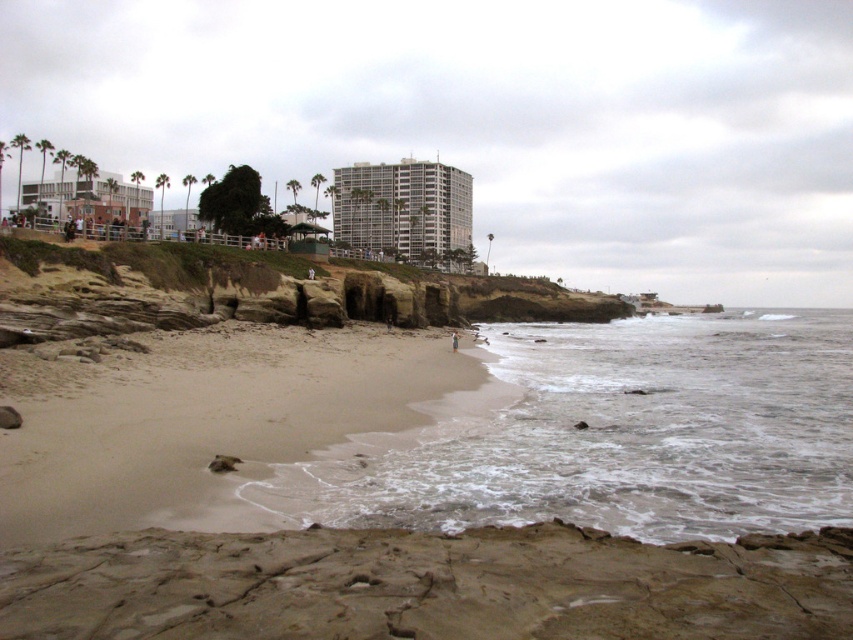
Which is more to the left, brown sandy beach at lower center or sandy beach at lower left?

From the viewer's perspective, sandy beach at lower left appears more on the left side.

Who is more forward, (198,563) or (387,356)?

Point (198,563) is in front.

Identify the location of brown sandy beach at lower center. The height and width of the screenshot is (640, 853). (428, 586).

Is point (412, 605) behind point (445, 227)?

No.

Is brown sandy beach at lower center positioned before gray concrete building at center?

Yes, brown sandy beach at lower center is in front of gray concrete building at center.

Is point (392, 616) positioned behind point (465, 177)?

No, it is in front of (465, 177).

Find the location of a particular element. The height and width of the screenshot is (640, 853). brown sandy beach at lower center is located at coordinates (428, 586).

Is white foamy water at center wider than brown sandy beach at lower center?

Yes.

Which is below, white foamy water at center or brown sandy beach at lower center?

brown sandy beach at lower center is lower down.

Does point (611, 529) come farther from viewer compared to point (276, 593)?

Yes, point (611, 529) is behind point (276, 593).

Image resolution: width=853 pixels, height=640 pixels. I want to click on white foamy water at center, so click(x=631, y=433).